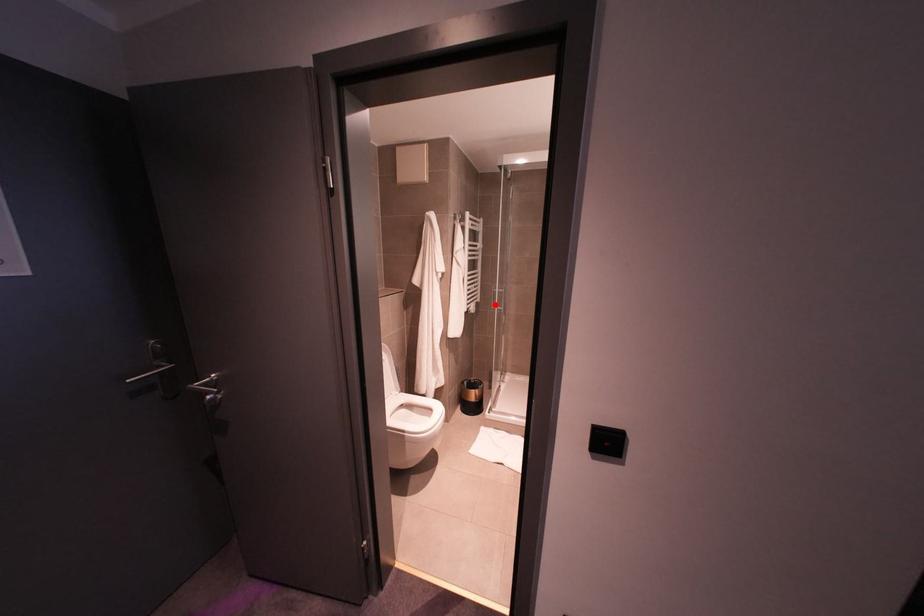
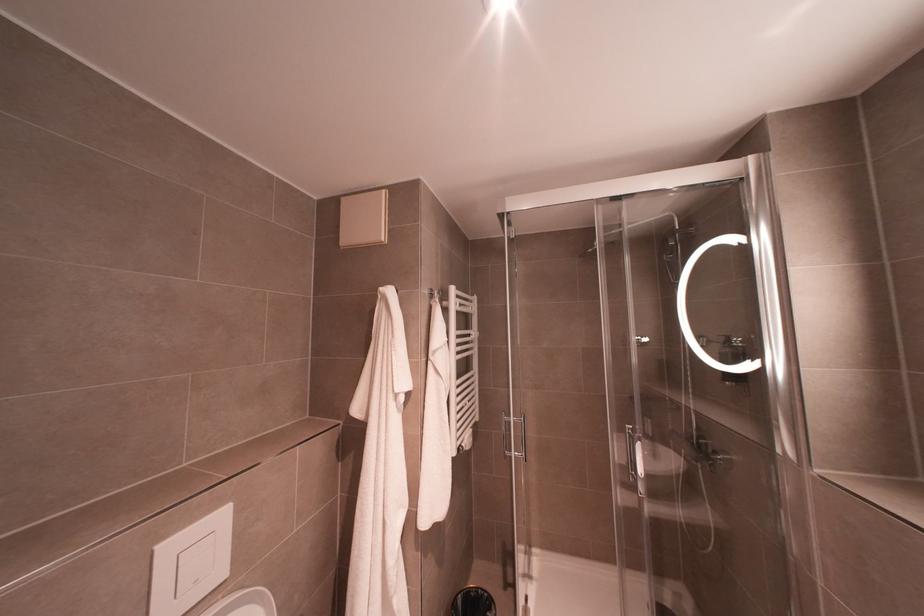
Where in the second image is the point corresponding to the highlighted location from the first image?

(511, 451)